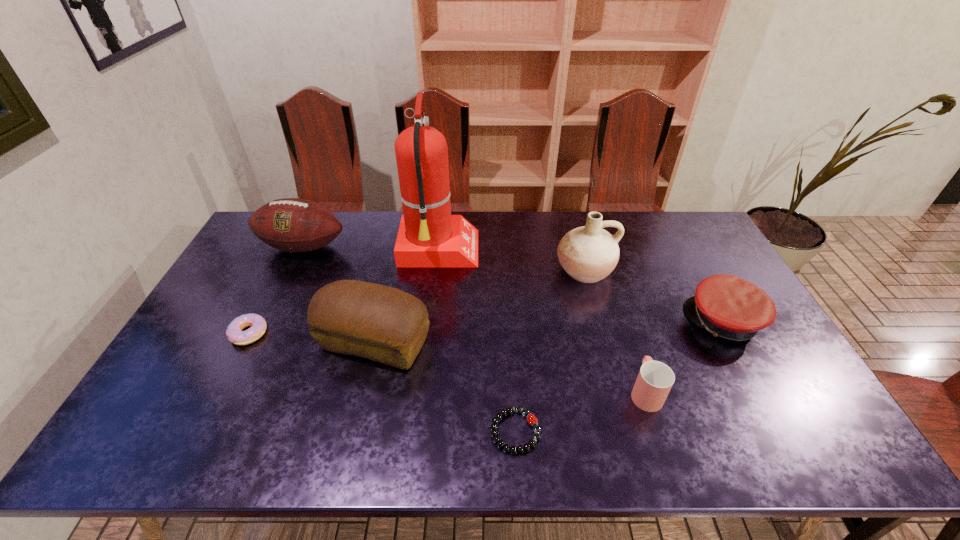
The image size is (960, 540). Identify the location of free area in between the seventh tallest object and the bread. (312, 339).

Identify the location of free spot between the cap and the bread. This screenshot has height=540, width=960. (549, 333).

At what (x,y) coordinates should I click in order to perform the action: click on object that is the seventh closest to the rightmost object. Please return your answer as a coordinate pair (x, y). Looking at the image, I should click on [x=257, y=324].

Where is `object identified as the third closest to the pottery`? The width and height of the screenshot is (960, 540). object identified as the third closest to the pottery is located at coordinates (655, 379).

Find the location of a particular element. vacant space that satisfies the following two spatial constraints: 1. on the front-facing side of the fifth object from left to right; 2. on the left side of the fire extinguisher is located at coordinates (420, 431).

The width and height of the screenshot is (960, 540). Find the location of `vacant area in the image that satisfies the following two spatial constraints: 1. on the front-facing side of the tallest object; 2. on the right side of the bracelet`. vacant area in the image that satisfies the following two spatial constraints: 1. on the front-facing side of the tallest object; 2. on the right side of the bracelet is located at coordinates (420, 431).

At what (x,y) coordinates should I click in order to perform the action: click on vacant space that satisfies the following two spatial constraints: 1. on the front-facing side of the fire extinguisher; 2. on the side of the cup with the handle. Please return your answer as a coordinate pair (x, y). The image size is (960, 540). Looking at the image, I should click on (423, 392).